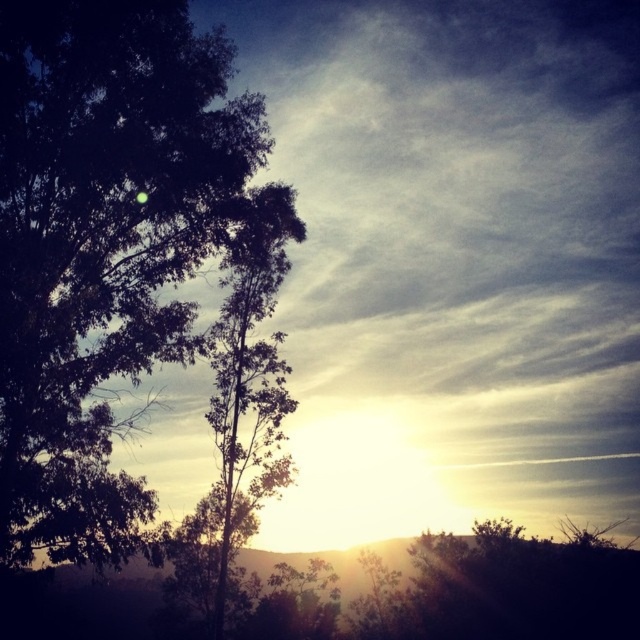
Which is more to the left, dark green leafy tree at left or green leafy tree at left?

dark green leafy tree at left

Can you confirm if dark green leafy tree at left is positioned below green leafy tree at left?

Incorrect, dark green leafy tree at left is not positioned below green leafy tree at left.

Is point (88, 29) closer to camera compared to point (273, 209)?

Yes, it is.

This screenshot has width=640, height=640. In order to click on dark green leafy tree at left in this screenshot , I will do `click(106, 243)`.